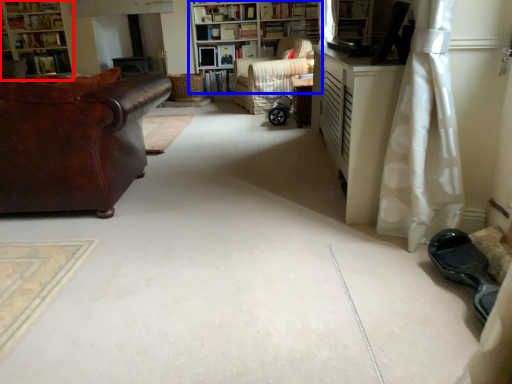
Question: Among these objects, which one is nearest to the camera, bookcase (highlighted by a red box) or bookcase (highlighted by a blue box)?

Choices:
 (A) bookcase
 (B) bookcase

Answer: (B)